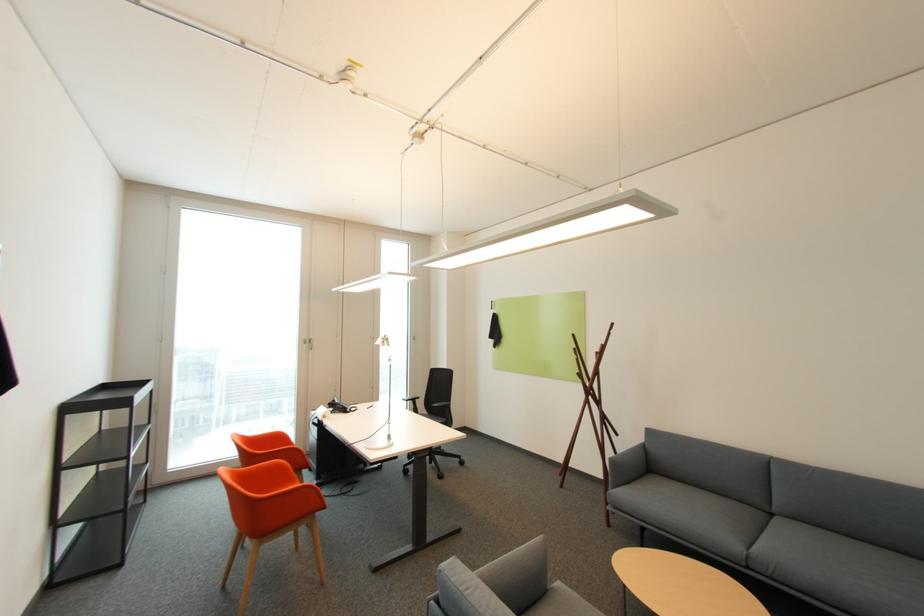
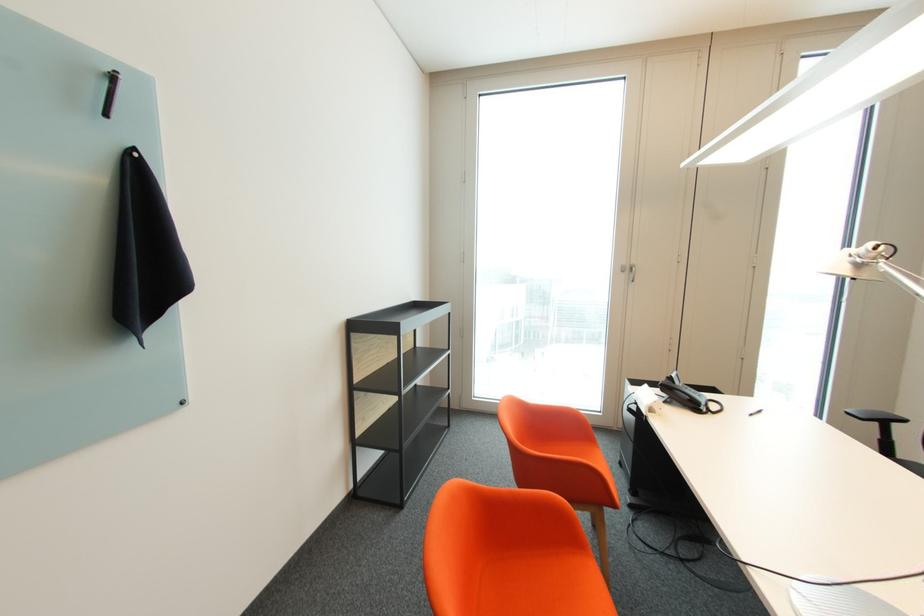
The point at (310, 342) is marked in the first image. Where is the corresponding point in the second image?

(629, 272)